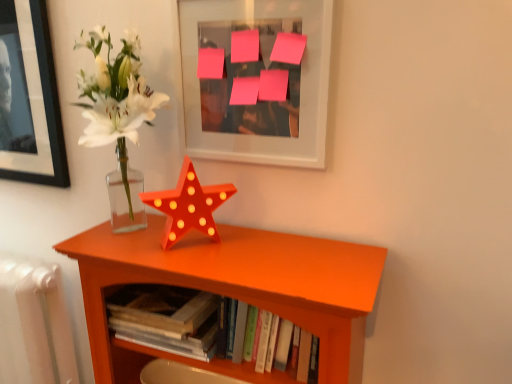
Where is `vacant space positioned to the left of matte glass vase at center left`? vacant space positioned to the left of matte glass vase at center left is located at coordinates (131, 248).